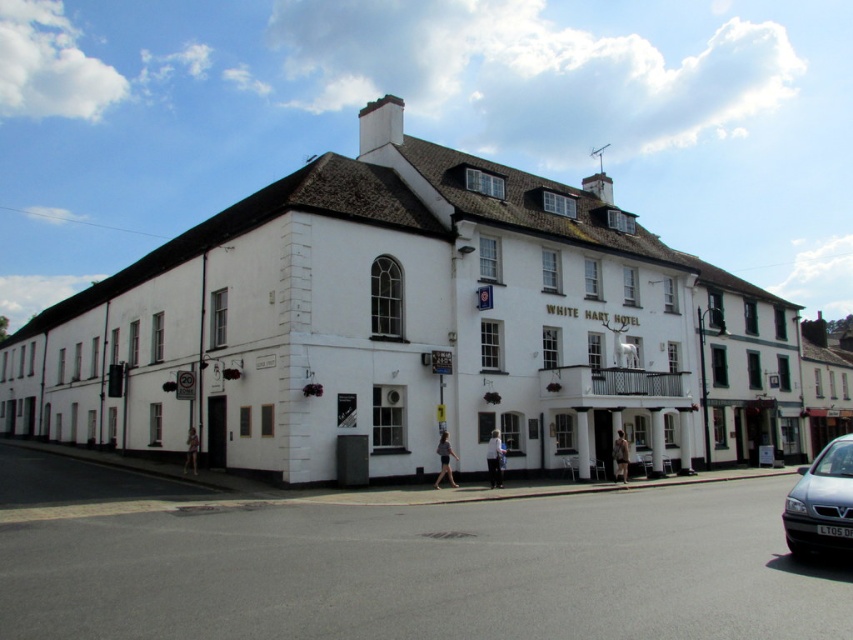
You are a delivery person who needs to park your vehicle in front of the White Hart Hotel. The parking spot available is exactly the width of the silver metallic van at lower right. Can your white painted building at center fit into this parking spot?

The white painted building at center might be wider than the silver metallic van at lower right, so it is uncertain if it can fit into the parking spot. You should measure the width of the building and compare it to the parking spot before deciding.

You are a photographer planning to take a wide shot of the white painted building at center and the silver metallic van at lower right. Given that the van is closer to you, will the van appear larger than the building in the photo?

The white painted building at center is larger in size than the silver metallic van at lower right. Even though the van is closer, the building is inherently bigger, so in the photo, the building will still appear larger than the van.

You are standing on the street in front of the White Hart Hotel. If you face the building, which direction should you turn to see the white painted building at center?

The white painted building at center is located at the center of the scene, so you are already facing it directly. No turn is necessary.